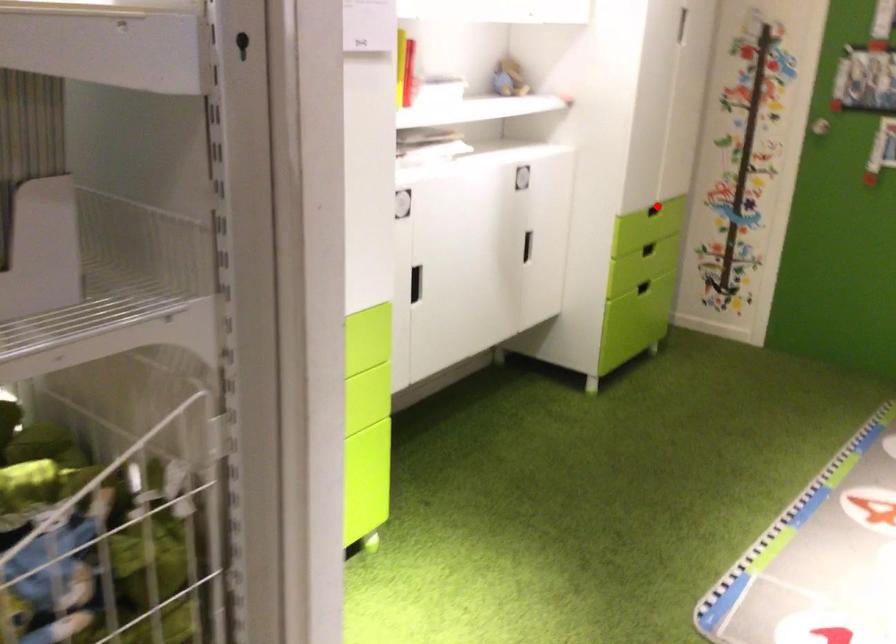
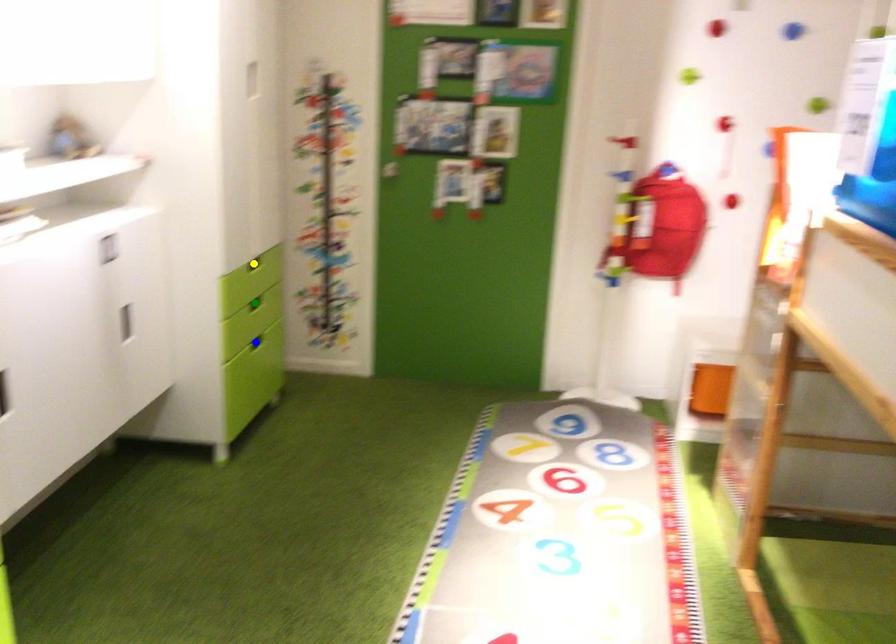
Question: I am providing you with two images of the same scene from different viewpoints. A red point is marked on the first image. You are given multiple points on the second image. In image 2, which mark is for the same physical point as the one in image 1?

Choices:
 (A) yellow point
 (B) blue point
 (C) green point

Answer: (A)